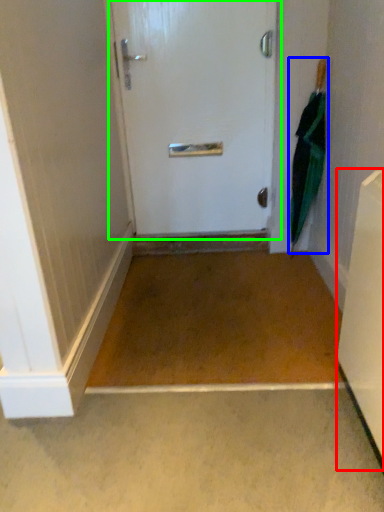
Question: Estimate the real-world distances between objects in this image. Which object is closer to appliance (highlighted by a red box), umbrella (highlighted by a blue box) or door (highlighted by a green box)?

Choices:
 (A) umbrella
 (B) door

Answer: (A)